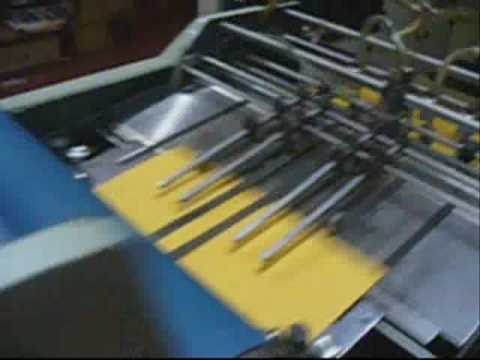
Identify the location of rod. The height and width of the screenshot is (360, 480). (201, 238).